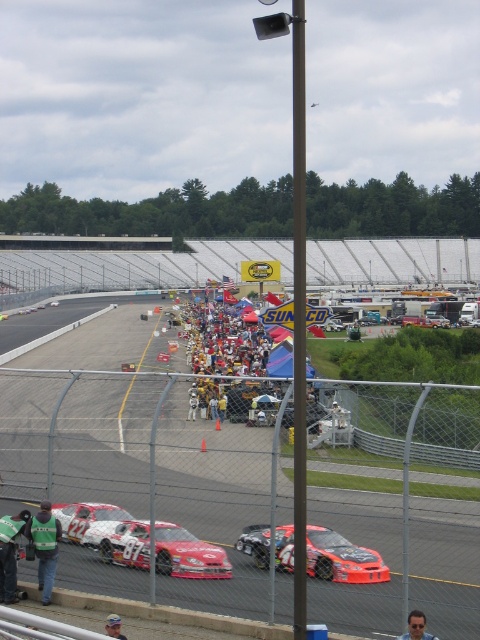
Is multicolored fabric crowd at center below green jersey at lower left?

Incorrect, multicolored fabric crowd at center is not positioned below green jersey at lower left.

Is multicolored fabric crowd at center above green jersey at lower left?

Indeed, multicolored fabric crowd at center is positioned over green jersey at lower left.

Who is more distant from viewer, (213, 369) or (50, 573)?

Point (213, 369)

The image size is (480, 640). I want to click on multicolored fabric crowd at center, so click(x=230, y=360).

Can you confirm if multicolored fabric crowd at center is smaller than light blue baseball cap at lower center?

No, multicolored fabric crowd at center is not smaller than light blue baseball cap at lower center.

Is point (255, 387) positioned after point (120, 634)?

Yes, it is behind point (120, 634).

The width and height of the screenshot is (480, 640). I want to click on multicolored fabric crowd at center, so click(x=230, y=360).

Is point (15, 586) positioned before point (116, 624)?

That is False.

Does green fabric jacket at lower left appear on the right side of light blue baseball cap at lower center?

In fact, green fabric jacket at lower left is to the left of light blue baseball cap at lower center.

Find the location of `green fabric jacket at lower left`. green fabric jacket at lower left is located at coordinates (10, 554).